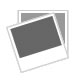
At what (x,y) coordinates should I click in order to perform the action: click on picture. Please return your answer as a coordinate pair (x, y). The image size is (80, 80). Looking at the image, I should click on (51, 57).